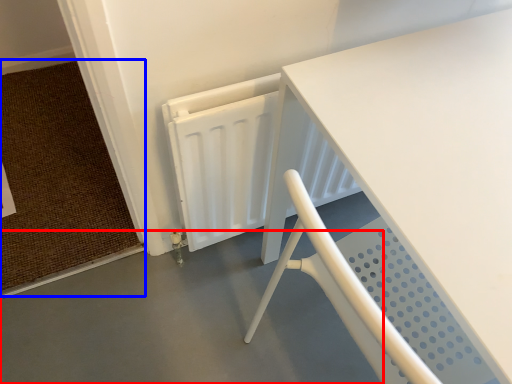
Question: Which point is closer to the camera, concrete (highlighted by a red box) or doormat (highlighted by a blue box)?

Choices:
 (A) concrete
 (B) doormat

Answer: (A)